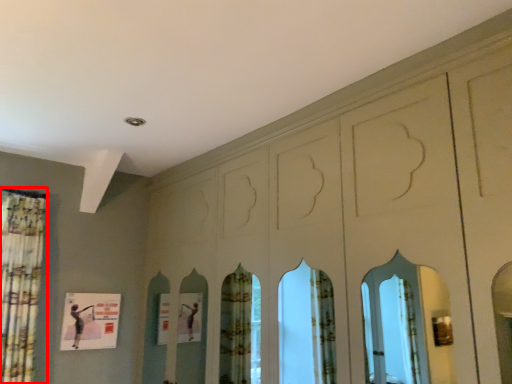
Question: From the image's perspective, considering the relative positions of shower curtain (annotated by the red box) and poster in the image provided, where is shower curtain (annotated by the red box) located with respect to the staircase?

Choices:
 (A) below
 (B) above

Answer: (B)